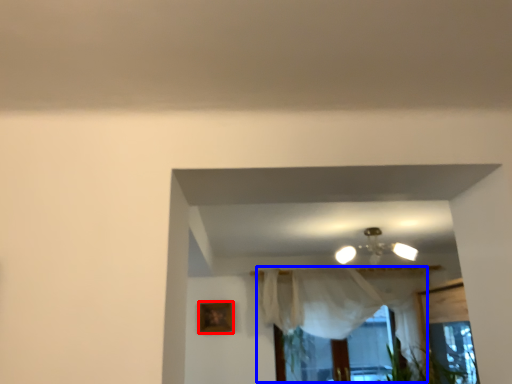
Question: Which point is further to the camera, picture frame (highlighted by a red box) or curtain (highlighted by a blue box)?

Choices:
 (A) picture frame
 (B) curtain

Answer: (A)